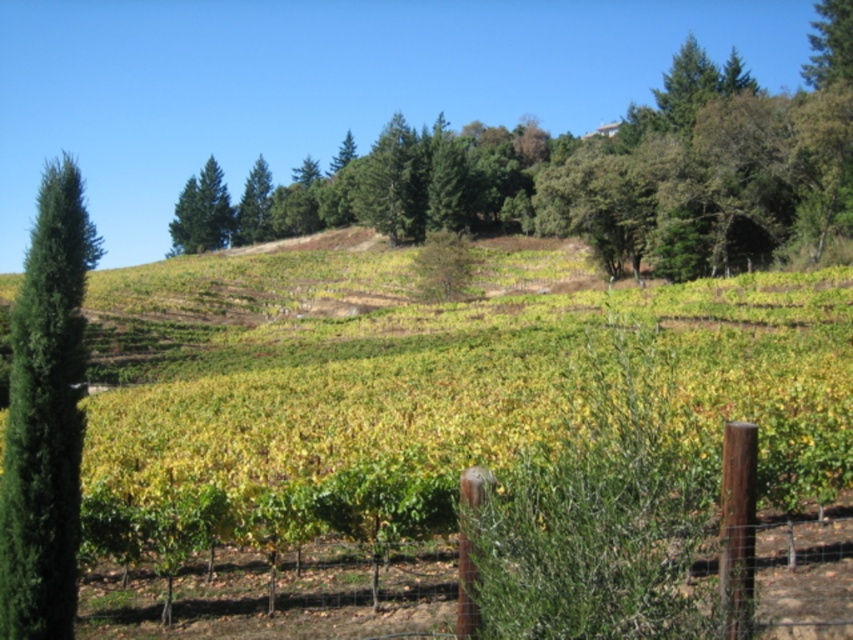
You are standing at the base of the vineyard and looking towards the green leafy hillside at center and the brown wooden post at center. Which object is higher in your field of view?

The green leafy hillside at center is above the brown wooden post at center in your field of view.